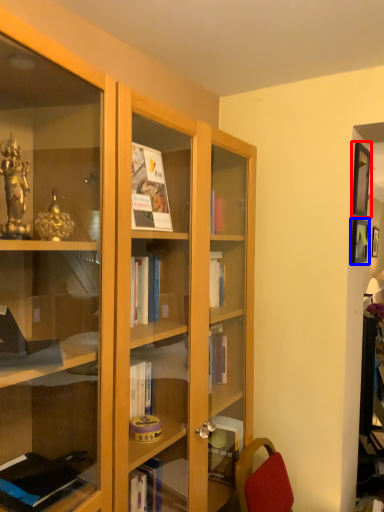
Question: Which of the following is the closest to the observer, picture frame (highlighted by a red box) or picture frame (highlighted by a blue box)?

Choices:
 (A) picture frame
 (B) picture frame

Answer: (A)